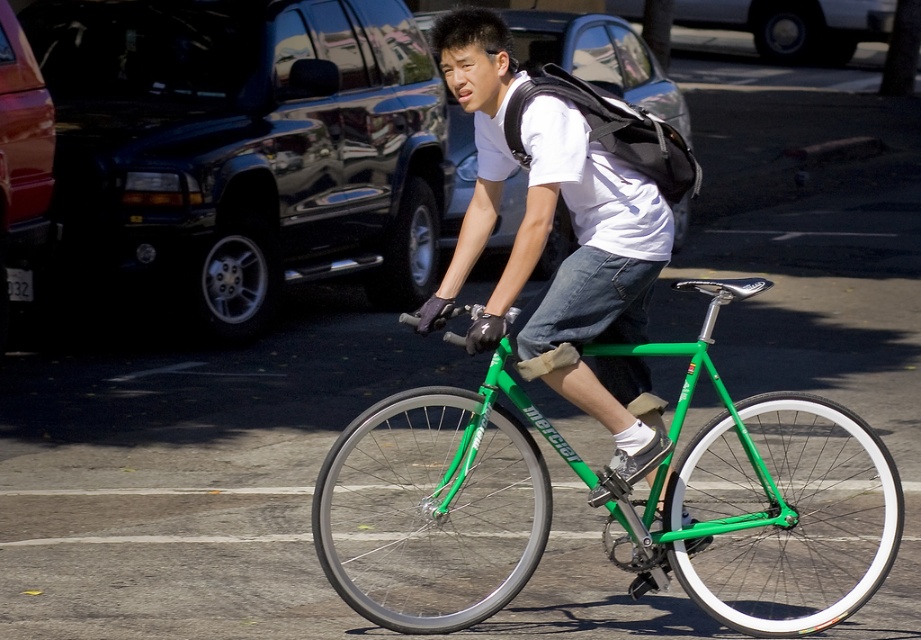
Who is shorter, green matte bicycle at center or matte green bicycle at center?

green matte bicycle at center

Can you confirm if green matte bicycle at center is bigger than matte green bicycle at center?

Yes.

At what (x,y) coordinates should I click in order to perform the action: click on green matte bicycle at center. Please return your answer as a coordinate pair (x, y). Looking at the image, I should click on (773, 508).

Image resolution: width=921 pixels, height=640 pixels. What are the coordinates of `green matte bicycle at center` in the screenshot? It's located at (773, 508).

Is point (245, 237) less distant than point (625, 150)?

No, it is not.

I want to click on shiny black suv at upper left, so click(245, 147).

Can you confirm if matte green bicycle at center is thinner than black fabric backpack at upper center?

In fact, matte green bicycle at center might be wider than black fabric backpack at upper center.

Can you confirm if matte green bicycle at center is shorter than black fabric backpack at upper center?

Incorrect, matte green bicycle at center's height does not fall short of black fabric backpack at upper center's.

Does point (585, 134) come closer to viewer compared to point (507, 132)?

Yes, it is.

Locate an element on the screen. Image resolution: width=921 pixels, height=640 pixels. matte green bicycle at center is located at coordinates (586, 280).